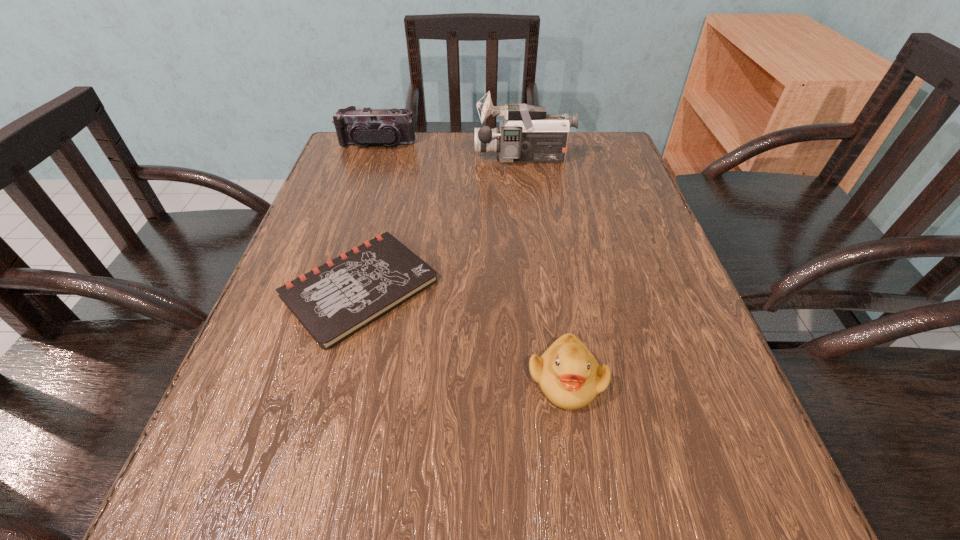
Locate an element on the screen. This screenshot has width=960, height=540. vacant space located on the front of the notebook is located at coordinates (324, 421).

At what (x,y) coordinates should I click in order to perform the action: click on camcorder present at the left edge. Please return your answer as a coordinate pair (x, y). The width and height of the screenshot is (960, 540). Looking at the image, I should click on [x=366, y=126].

The height and width of the screenshot is (540, 960). In order to click on notebook that is at the left edge in this screenshot , I will do `click(337, 299)`.

Where is `object that is at the right edge`? This screenshot has width=960, height=540. object that is at the right edge is located at coordinates (527, 134).

You are a GUI agent. You are given a task and a screenshot of the screen. Output one action in this format:
    pyautogui.click(x=<x>, y=<y>)
    Task: Click on the object that is at the far left corner
    The width and height of the screenshot is (960, 540).
    Given the screenshot: What is the action you would take?
    pyautogui.click(x=366, y=126)

Where is `object at the far right corner`? object at the far right corner is located at coordinates (527, 134).

Identify the location of vacant space at the far edge of the desktop. (431, 138).

Identify the location of free region at the left edge of the desktop. This screenshot has height=540, width=960. (308, 337).

Where is `free location at the right edge of the desktop`? free location at the right edge of the desktop is located at coordinates (615, 269).

Locate an element on the screen. Image resolution: width=960 pixels, height=540 pixels. free location at the far right corner of the desktop is located at coordinates [595, 164].